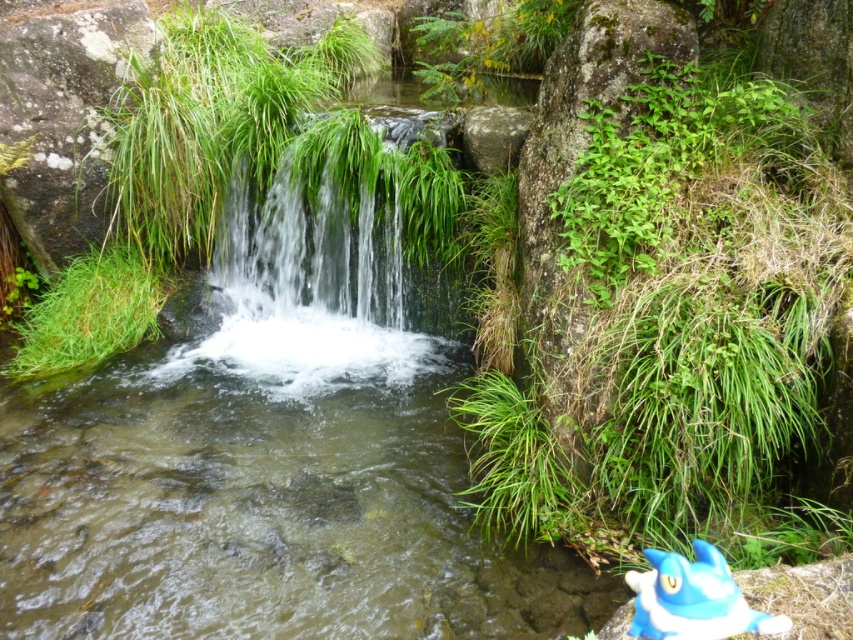
Is clear water cascade at center further to the viewer compared to blue plush toy at lower right?

Yes, it is.

Is point (354, 253) positioned after point (701, 634)?

Yes, it is.

Where is `clear water cascade at center`? clear water cascade at center is located at coordinates (303, 284).